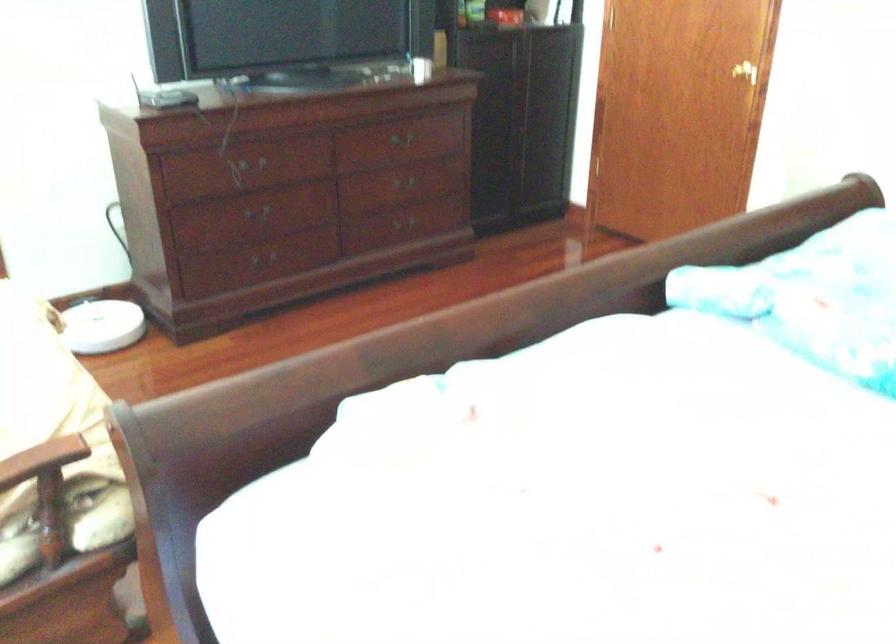
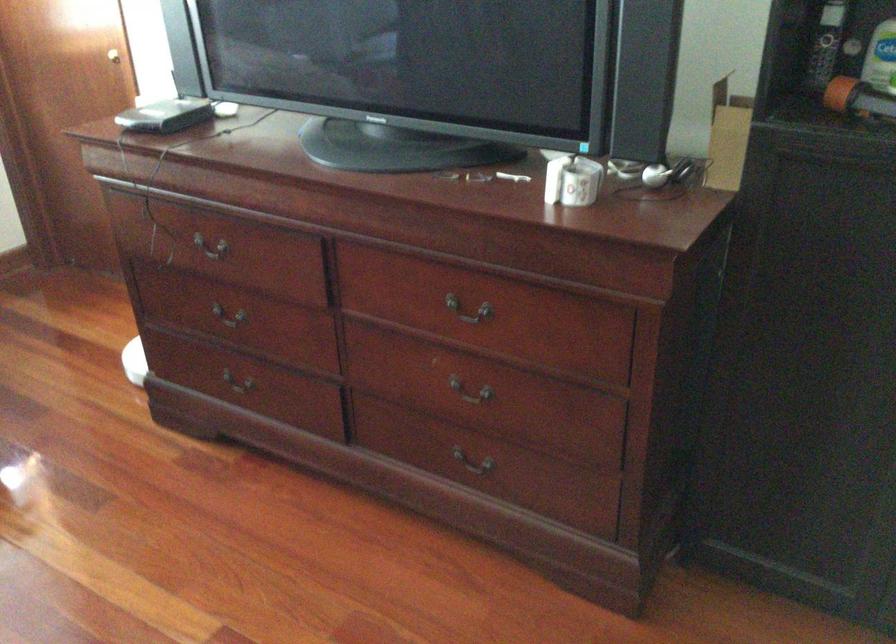
The point at (x=222, y=164) is marked in the first image. Where is the corresponding point in the second image?

(211, 241)